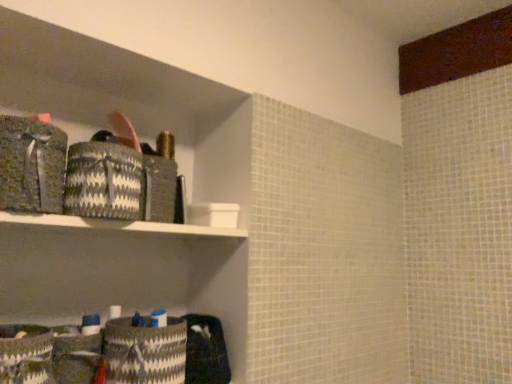
Question: Is textured gray fabric at left, marked as the 1th material in a top-to-bottom arrangement, positioned in front of black and white woven basket at upper left, which appears as the 2th material when viewed from the top?

Choices:
 (A) yes
 (B) no

Answer: (A)

Question: Considering the relative sizes of textured gray fabric at left, marked as the 1th material in a top-to-bottom arrangement, and black and white woven basket at upper left, which appears as the 2th material when ordered from the bottom, in the image provided, is textured gray fabric at left, marked as the 1th material in a top-to-bottom arrangement, taller than black and white woven basket at upper left, which appears as the 2th material when ordered from the bottom,?

Choices:
 (A) yes
 (B) no

Answer: (A)

Question: Is textured gray fabric at left, which ranks as the third material in bottom-to-top order, positioned with its back to black and white woven basket at upper left, which appears as the 2th material when ordered from the bottom?

Choices:
 (A) no
 (B) yes

Answer: (A)

Question: Is textured gray fabric at left, marked as the 1th material in a top-to-bottom arrangement, not close to black and white woven basket at upper left, which appears as the 2th material when ordered from the bottom?

Choices:
 (A) no
 (B) yes

Answer: (A)

Question: Does textured gray fabric at left, marked as the 1th material in a top-to-bottom arrangement, have a lesser width compared to black and white woven basket at upper left, which appears as the 2th material when ordered from the bottom?

Choices:
 (A) no
 (B) yes

Answer: (A)

Question: Is textured gray fabric at left, which ranks as the third material in bottom-to-top order, smaller than black and white woven basket at upper left, which appears as the 2th material when viewed from the top?

Choices:
 (A) yes
 (B) no

Answer: (B)

Question: Is black and white woven basket at upper left, which appears as the 2th material when viewed from the top, aimed at textured gray fabric at left, which ranks as the third material in bottom-to-top order?

Choices:
 (A) no
 (B) yes

Answer: (A)

Question: Is textured gray fabric at left, marked as the 1th material in a top-to-bottom arrangement, a part of black and white woven basket at upper left, which appears as the 2th material when viewed from the top?

Choices:
 (A) no
 (B) yes

Answer: (A)

Question: Does black and white woven basket at upper left, which appears as the 2th material when ordered from the bottom, have a smaller size compared to textured gray fabric at left, marked as the 1th material in a top-to-bottom arrangement?

Choices:
 (A) yes
 (B) no

Answer: (A)

Question: Does black and white woven basket at upper left, which appears as the 2th material when viewed from the top, have a greater height compared to textured gray fabric at left, marked as the 1th material in a top-to-bottom arrangement?

Choices:
 (A) no
 (B) yes

Answer: (A)

Question: From a real-world perspective, is black and white woven basket at upper left, which appears as the 2th material when ordered from the bottom, physically below textured gray fabric at left, which ranks as the third material in bottom-to-top order?

Choices:
 (A) no
 (B) yes

Answer: (B)

Question: Is black and white woven basket at upper left, which appears as the 2th material when viewed from the top, in contact with textured gray fabric at left, which ranks as the third material in bottom-to-top order?

Choices:
 (A) yes
 (B) no

Answer: (A)

Question: Considering the relative sizes of black and white woven basket at upper left, which appears as the 2th material when viewed from the top, and white and black woven basket at lower left, which appears as the 3th material when viewed from the top, in the image provided, is black and white woven basket at upper left, which appears as the 2th material when viewed from the top, shorter than white and black woven basket at lower left, which appears as the 3th material when viewed from the top,?

Choices:
 (A) no
 (B) yes

Answer: (B)